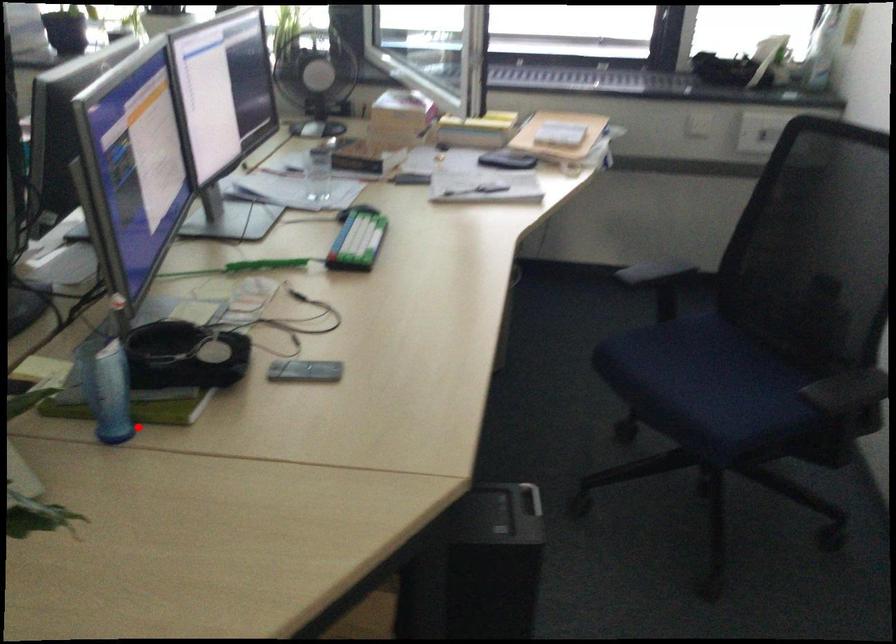
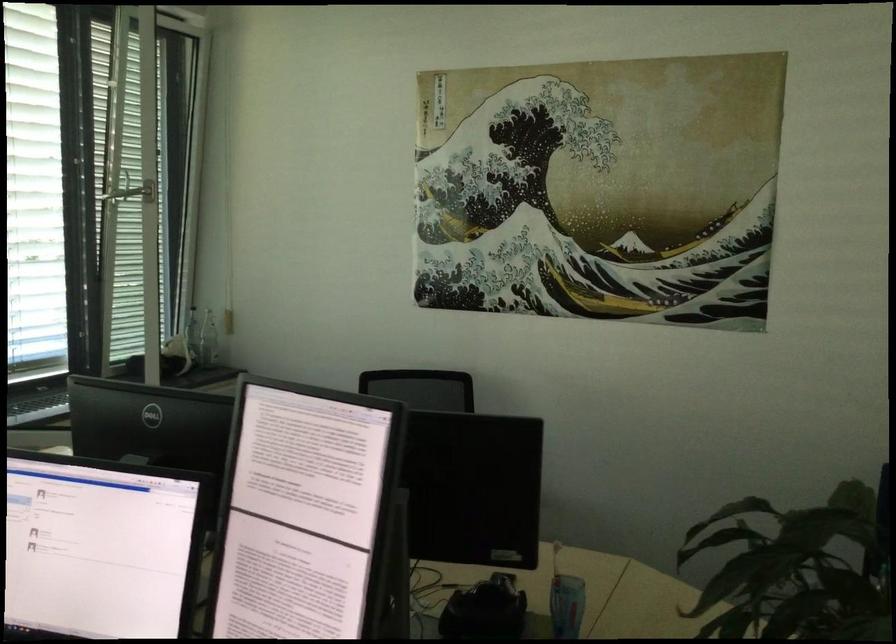
Question: I am providing you with two images of the same scene from different viewpoints. A red point is shown in image1. For the corresponding object point in image2, is it positioned nearer or farther from the camera?

Choices:
 (A) Nearer
 (B) Farther

Answer: (B)